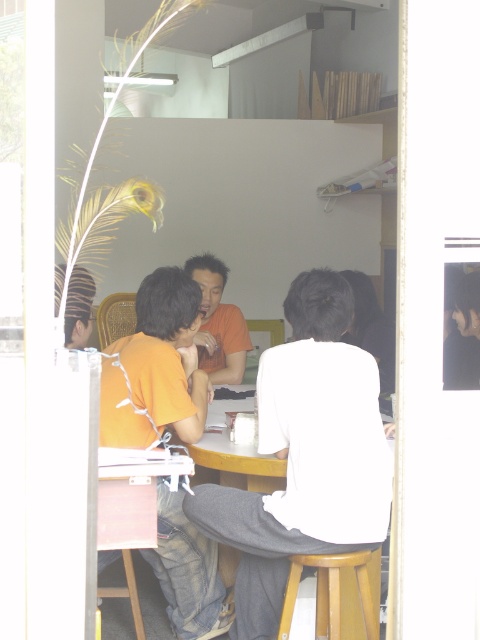
You are organizing a photo shoot and need to place a 1.2 meter wide backdrop behind the two people at the table. Considering the white matte shirt at center and the orange cotton shirt at center, which person should you position closer to the backdrop to ensure the backdrop covers them adequately?

The white matte shirt at center is wider than the orange cotton shirt at center, so positioning the white matte shirt at center closer to the backdrop would ensure better coverage since wider subjects require more space on the backdrop.

Based on the photo, you are a photographer trying to capture a clear shot of the orange cotton shirt at center and the orange matte shirt at center. Since both are orange, which one is closer to the camera so you can focus on it first?

The orange cotton shirt at center is in front of the orange matte shirt at center, so it is closer to the camera and should be focused on first.